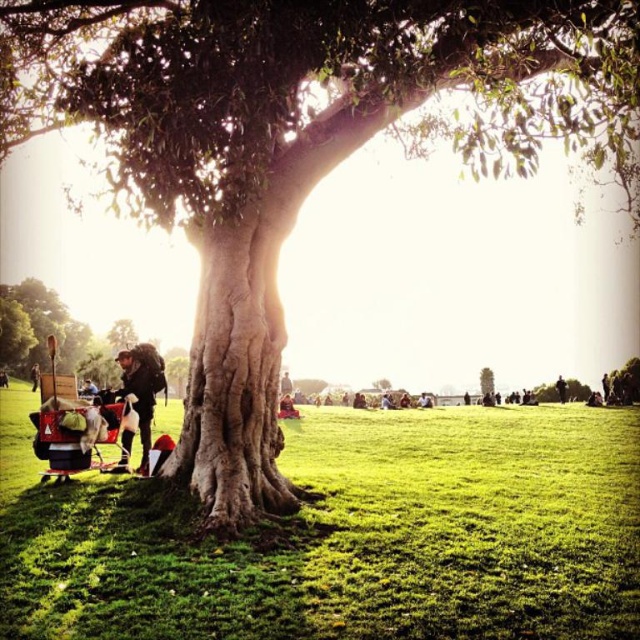
Question: Is green grass at lower left wider than matte black backpack at left?

Choices:
 (A) yes
 (B) no

Answer: (A)

Question: Considering the relative positions of green grass at lower left and matte black baby carriage at lower left in the image provided, where is green grass at lower left located with respect to matte black baby carriage at lower left?

Choices:
 (A) left
 (B) right

Answer: (B)

Question: Is green mossy tree at lower left bigger than matte black backpack at left?

Choices:
 (A) yes
 (B) no

Answer: (A)

Question: Which point appears farthest from the camera in this image?

Choices:
 (A) (70, 413)
 (B) (134, 378)
 (C) (42, 307)
 (D) (326, 636)

Answer: (C)

Question: Which point is closer to the camera?

Choices:
 (A) click(x=448, y=486)
 (B) click(x=492, y=376)
 (C) click(x=4, y=317)

Answer: (A)

Question: Which point is closer to the camera taking this photo?

Choices:
 (A) (40, 332)
 (B) (324, 618)

Answer: (B)